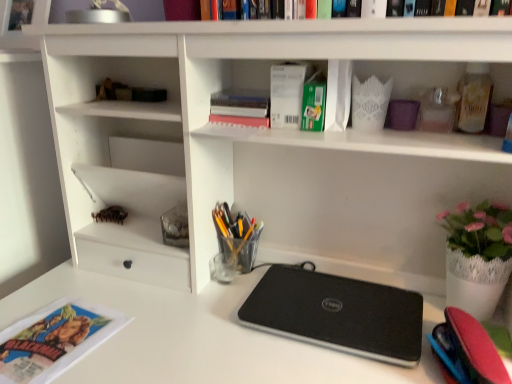
At what (x,y) coordinates should I click in order to perform the action: click on blank space situated above black matte laptop at center (from a real-world perspective). Please return your answer as a coordinate pair (x, y). The height and width of the screenshot is (384, 512). Looking at the image, I should click on (332, 298).